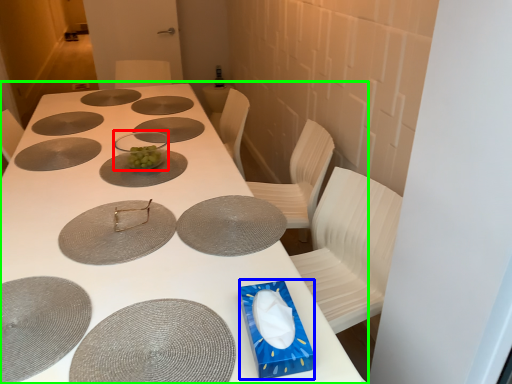
Question: Which object is positioned closest to glass bowl (highlighted by a red box)? Select from box (highlighted by a blue box) and table (highlighted by a green box).

Choices:
 (A) box
 (B) table

Answer: (B)